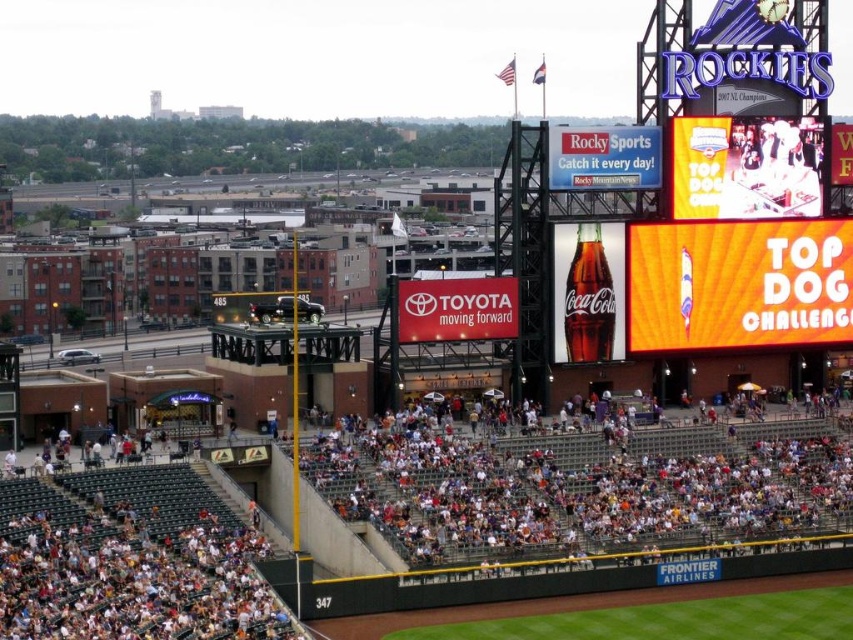
Question: Does multicolored plastic seats at center have a lesser width compared to yellow fabric scoreboard at upper right?

Choices:
 (A) no
 (B) yes

Answer: (A)

Question: Which object is the farthest from the yellow fabric scoreboard at upper right?

Choices:
 (A) white plastic seats at lower center
 (B) multicolored plastic seats at center

Answer: (A)

Question: Does white plastic seats at lower center appear over multicolored plastic seats at center?

Choices:
 (A) yes
 (B) no

Answer: (B)

Question: Which point is closer to the camera?

Choices:
 (A) (590, 536)
 (B) (714, 266)

Answer: (A)

Question: Does white plastic seats at lower center have a greater width compared to yellow fabric scoreboard at upper right?

Choices:
 (A) yes
 (B) no

Answer: (A)

Question: Which of the following is the farthest from the observer?

Choices:
 (A) (827, 492)
 (B) (53, 621)
 (C) (722, 253)

Answer: (C)